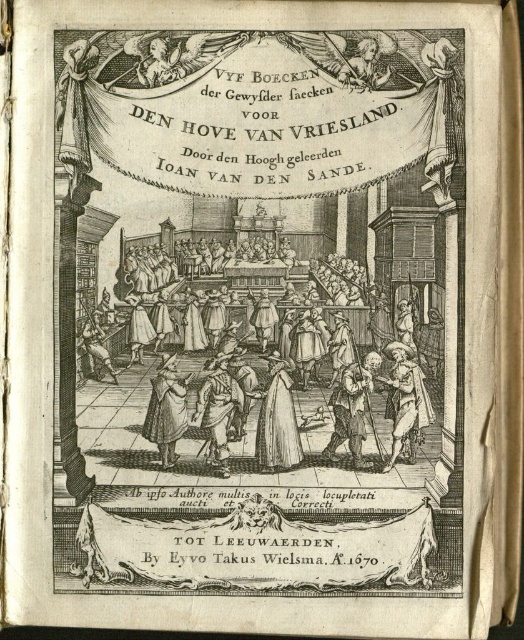
Question: Where is white paper dress at center located in relation to smooth white statue at upper center in the image?

Choices:
 (A) right
 (B) left

Answer: (B)

Question: Which is farther from the gold metallic banner at lower center?

Choices:
 (A) brown leather coat at center
 (B) smooth white statue at upper center
 (C) white paper dress at center

Answer: (B)

Question: Among these objects, which one is nearest to the camera?

Choices:
 (A) wooden chair at center
 (B) gold metallic banner at lower center
 (C) white paper dress at center

Answer: (B)

Question: Does wooden chair at center have a greater width compared to brown leather coat at center?

Choices:
 (A) no
 (B) yes

Answer: (B)

Question: Which point appears closest to the camera in this image?

Choices:
 (A) (269, 387)
 (B) (233, 276)

Answer: (A)

Question: Observing the image, what is the correct spatial positioning of wooden chair at center in reference to smooth white statue at upper center?

Choices:
 (A) above
 (B) below

Answer: (B)